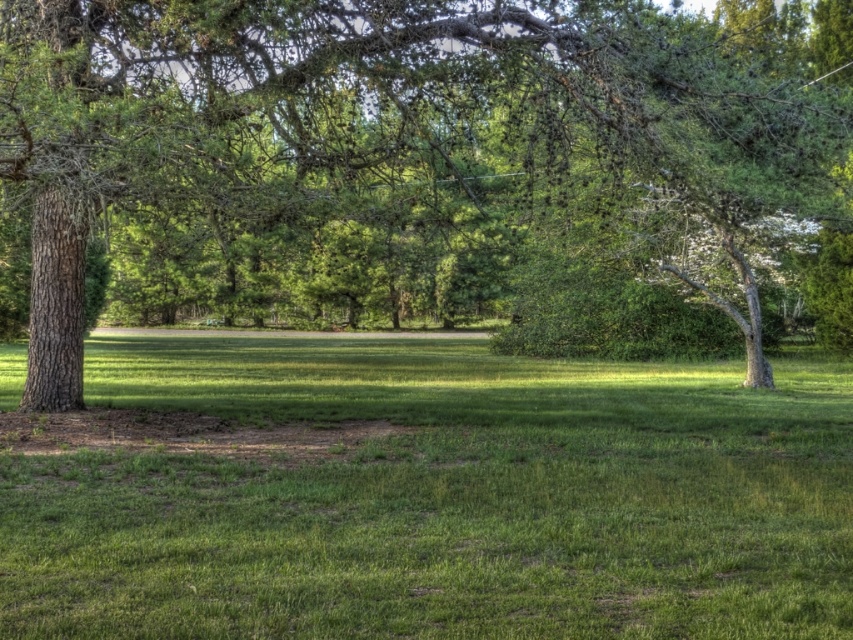
You are standing at the center of the image and want to walk towards the green textured tree at left. In which direction should you move?

You should move to the left because the green textured tree at left is located at point 0.263 on the x axis, which is to the left of the center position at 0.5 on the x axis.

You are standing at the edge of the green grassy field at center and want to walk towards the green textured tree at left. Which direction should you head?

You should head to the left because the green textured tree at left is to the right of the green grassy field at center, so moving left from the field will lead you towards the tree.